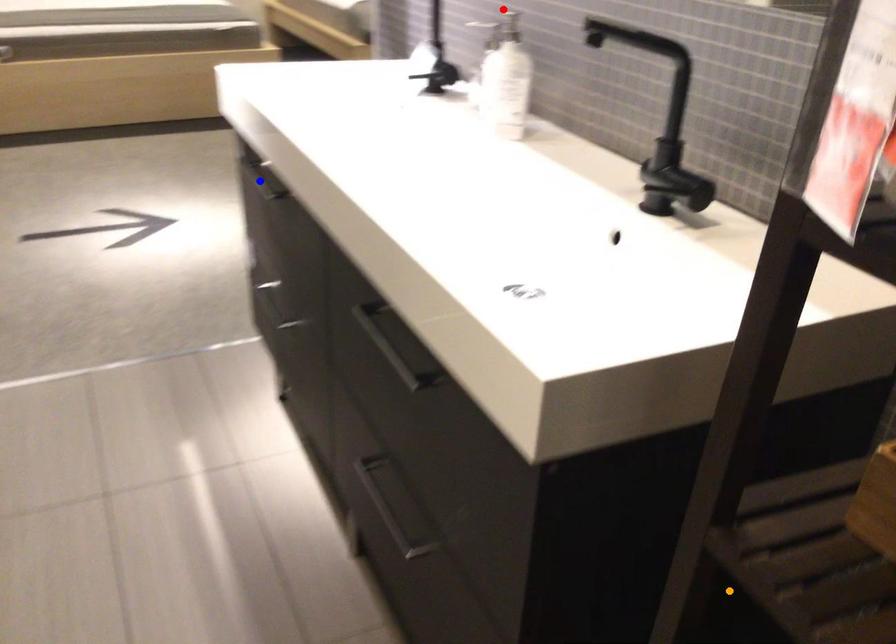
Order these from nearest to farthest:
blue point
orange point
red point

blue point → red point → orange point